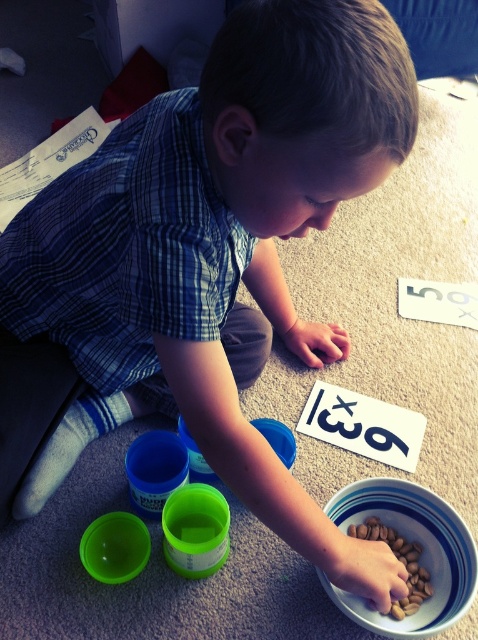
Does white glossy bowl at lower center have a lesser height compared to brown matte nuts at lower center?

Incorrect, white glossy bowl at lower center's height does not fall short of brown matte nuts at lower center's.

Does white glossy bowl at lower center appear on the right side of brown matte nuts at lower center?

No, white glossy bowl at lower center is not to the right of brown matte nuts at lower center.

Identify the location of white glossy bowl at lower center. The height and width of the screenshot is (640, 478). (421, 554).